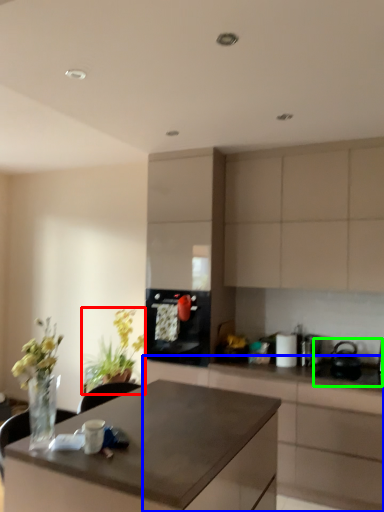
Question: Which object is positioned farthest from houseplant (highlighted by a red box)? Select from cabinetry (highlighted by a blue box) and sink (highlighted by a green box).

Choices:
 (A) cabinetry
 (B) sink

Answer: (B)